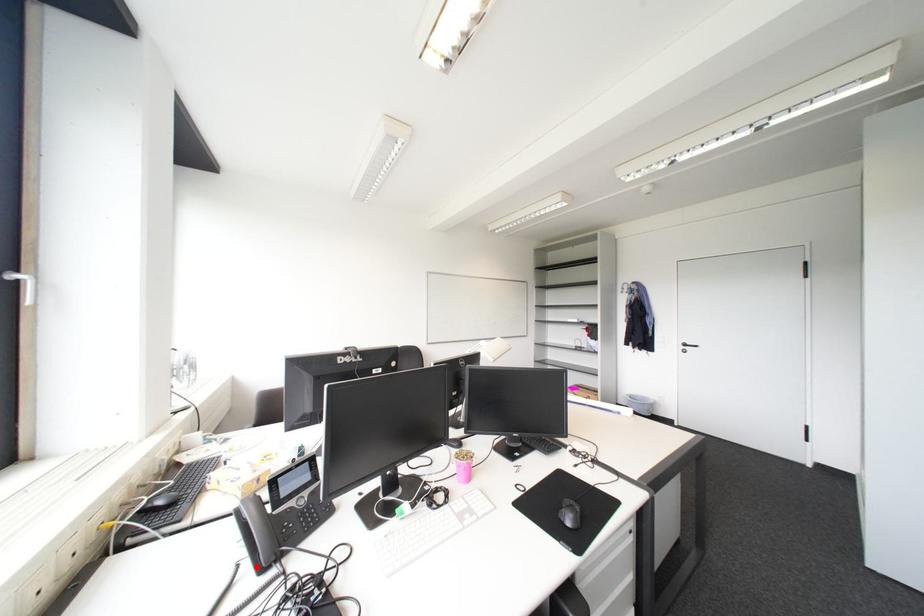
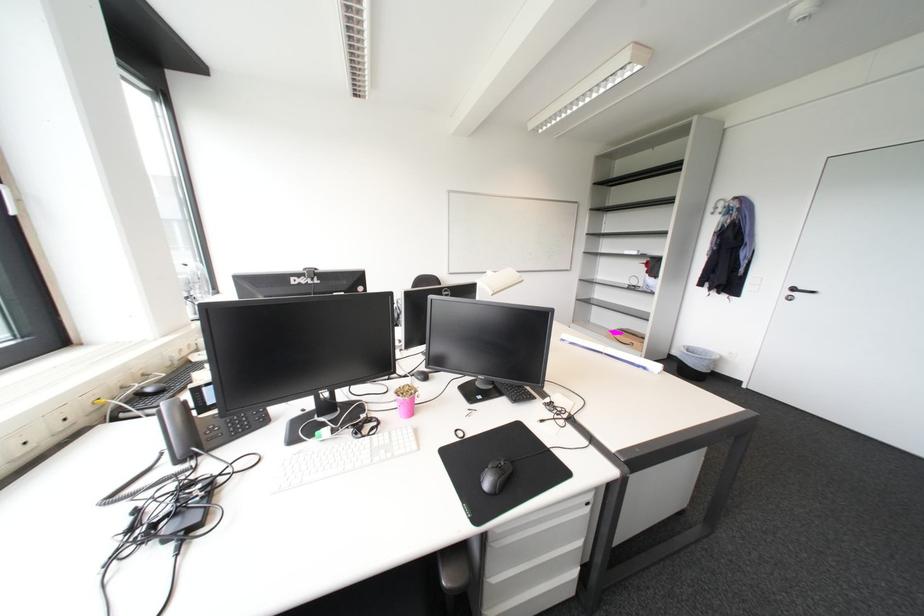
Find the pixel in the second image that matches the highlighted location in the first image.

(176, 456)